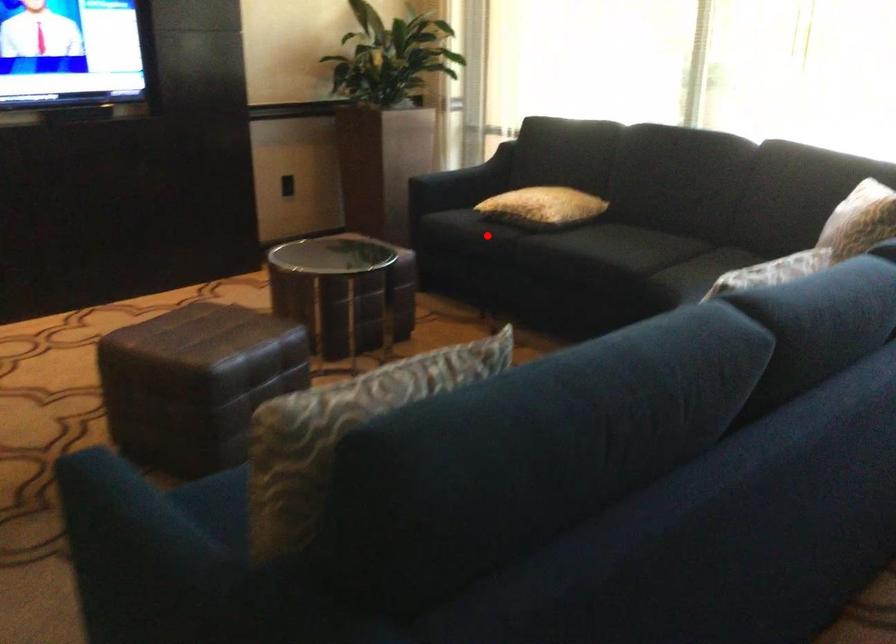
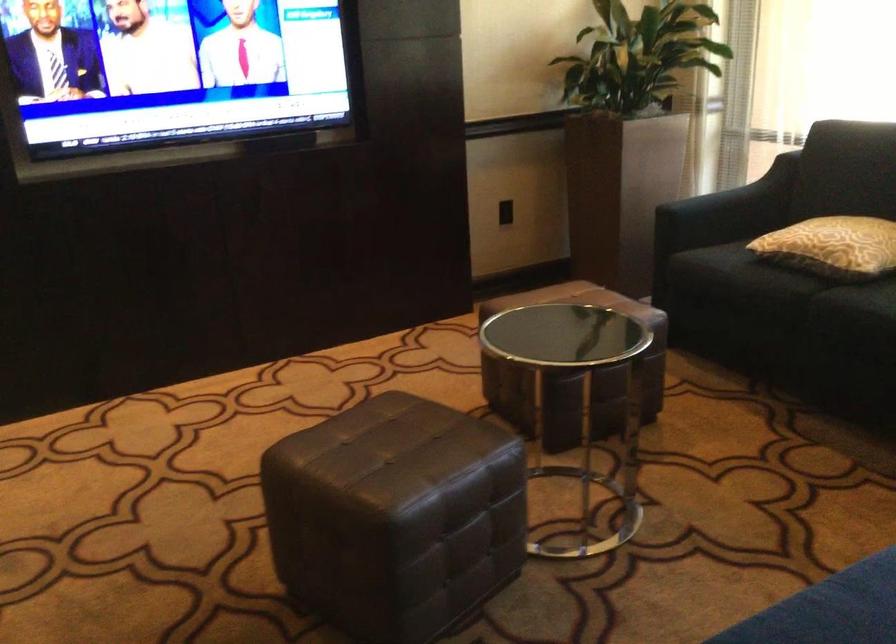
Question: I am providing you with two images of the same scene from different viewpoints. A red point is marked on the first image. Is the red point's position out of view in image 2?

Choices:
 (A) Yes
 (B) No

Answer: (B)